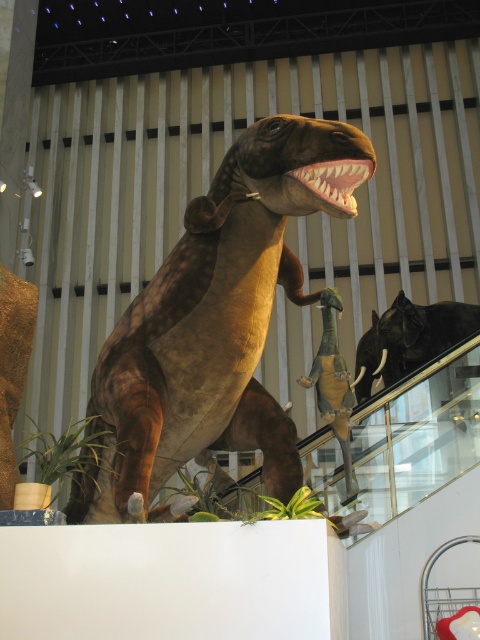
Question: Which of the following is the closest to the observer?

Choices:
 (A) (162, 323)
 (B) (340, 307)

Answer: (A)

Question: Which point is farther to the camera?

Choices:
 (A) (178, 435)
 (B) (300, 384)

Answer: (B)

Question: Which point is farther to the camera?

Choices:
 (A) shiny green plastic dinosaur at center
 (B) brown matte dinosaur at center

Answer: (A)

Question: Can you confirm if brown matte dinosaur at center is wider than shiny green plastic dinosaur at center?

Choices:
 (A) yes
 (B) no

Answer: (A)

Question: In this image, where is brown matte dinosaur at center located relative to shiny green plastic dinosaur at center?

Choices:
 (A) below
 (B) above

Answer: (B)

Question: Does brown matte dinosaur at center have a lesser width compared to shiny green plastic dinosaur at center?

Choices:
 (A) no
 (B) yes

Answer: (A)